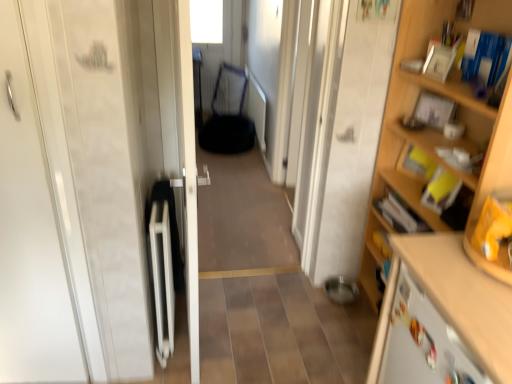
This screenshot has height=384, width=512. Describe the element at coordinates (228, 117) in the screenshot. I see `metallic mesh armchair at center` at that location.

The image size is (512, 384). In order to click on white glossy door at center, which is the first door in right-to-left order in this screenshot , I will do `click(188, 173)`.

Between wooden shelf at right and white glossy door at center, positioned as the second door in left-to-right order, which one has smaller width?

white glossy door at center, positioned as the second door in left-to-right order.

Is wooden shelf at right positioned with its back to white glossy door at center, positioned as the second door in left-to-right order?

No, white glossy door at center, positioned as the second door in left-to-right order, is not at the back of wooden shelf at right.

Would you consider wooden shelf at right to be distant from white glossy door at center, positioned as the second door in left-to-right order?

Absolutely, wooden shelf at right is distant from white glossy door at center, positioned as the second door in left-to-right order.

Can you confirm if wooden shelf at right is shorter than white glossy door at center, which is the first door in right-to-left order?

Incorrect, the height of wooden shelf at right does not fall short of that of white glossy door at center, which is the first door in right-to-left order.

From the picture: Between metallic mesh armchair at center and wooden shelf at right, which one has larger size?

With larger size is wooden shelf at right.

Is metallic mesh armchair at center positioned with its back to wooden shelf at right?

metallic mesh armchair at center does not have its back to wooden shelf at right.

Visually, is metallic mesh armchair at center positioned to the left or to the right of wooden shelf at right?

metallic mesh armchair at center is to the left of wooden shelf at right.

Considering the points (218, 139) and (510, 380), which point is in front, point (218, 139) or point (510, 380)?

Point (510, 380)

Find the location of a particular element. The height and width of the screenshot is (384, 512). armchair below the wooden cabinet at lower right (from a real-world perspective) is located at coordinates (228, 117).

Is wooden cabinet at lower right facing towards metallic mesh armchair at center?

No, wooden cabinet at lower right is not oriented towards metallic mesh armchair at center.

Which is closer to the camera, (462,336) or (240,99)?

The point (462,336) is in front.

Is wooden cabinet at lower right outside of metallic mesh armchair at center?

That's correct, wooden cabinet at lower right is outside of metallic mesh armchair at center.

Can you confirm if wooden cabinet at lower right is bigger than wooden shelf at right?

No.

Is wooden cabinet at lower right behind wooden shelf at right?

No, it is in front of wooden shelf at right.

Does wooden cabinet at lower right have a lesser height compared to wooden shelf at right?

Correct, wooden cabinet at lower right is not as tall as wooden shelf at right.

This screenshot has height=384, width=512. In order to click on cabinetry below the wooden shelf at right (from a real-world perspective) in this screenshot , I will do click(441, 316).

Is white glossy door at center, positioned as the second door in left-to-right order, oriented towards wooden cabinet at lower right?

No, white glossy door at center, positioned as the second door in left-to-right order, is not aimed at wooden cabinet at lower right.

Can you confirm if white glossy door at center, positioned as the second door in left-to-right order, is thinner than wooden cabinet at lower right?

Correct, the width of white glossy door at center, positioned as the second door in left-to-right order, is less than that of wooden cabinet at lower right.

From a real-world perspective, is white glossy door at center, positioned as the second door in left-to-right order, positioned under wooden cabinet at lower right based on gravity?

Incorrect, from a real-world perspective, white glossy door at center, positioned as the second door in left-to-right order, is higher than wooden cabinet at lower right.

Which object is positioned more to the right, white glossy door at center, positioned as the second door in left-to-right order, or wooden cabinet at lower right?

wooden cabinet at lower right is more to the right.

Which point is more distant from viewer, [437,332] or [205,123]?

Point [205,123]

Is metallic mesh armchair at center located within wooden shelf at right?

No, wooden shelf at right does not contain metallic mesh armchair at center.

Between wooden shelf at right and metallic mesh armchair at center, which one has more height?

With more height is wooden shelf at right.

Is wooden shelf at right far from metallic mesh armchair at center?

Yes.

Would you say wooden shelf at right contains wooden cabinet at lower right?

No.

This screenshot has height=384, width=512. Find the location of `cupboard behind the wooden cabinet at lower right`. cupboard behind the wooden cabinet at lower right is located at coordinates (439, 230).

From a real-world perspective, between wooden shelf at right and wooden cabinet at lower right, who is vertically lower?

wooden cabinet at lower right.

In the image, is wooden shelf at right on the left side or the right side of wooden cabinet at lower right?

Based on their positions, wooden shelf at right is located to the right of wooden cabinet at lower right.

Find the location of a particular element. cupboard on the right of white glossy door at center, positioned as the second door in left-to-right order is located at coordinates (439, 230).

Find the location of a particular element. The height and width of the screenshot is (384, 512). armchair that is on the left side of wooden shelf at right is located at coordinates (x=228, y=117).

Which object lies further to the anchor point white glossy door at left, which appears as the first door when viewed from the left, white glossy door at center, which is the first door in right-to-left order, or wooden shelf at right?

wooden shelf at right is positioned further to the anchor white glossy door at left, which appears as the first door when viewed from the left.

Estimate the real-world distances between objects in this image. Which object is closer to metallic mesh armchair at center, white glossy door at center, positioned as the second door in left-to-right order, or white glossy door at left, which appears as the first door when viewed from the left?

white glossy door at center, positioned as the second door in left-to-right order, is closer to metallic mesh armchair at center.

From the image, which object appears to be farther from wooden cabinet at lower right, white glossy door at left, placed as the second door when sorted from right to left, or wooden shelf at right?

The object further to wooden cabinet at lower right is white glossy door at left, placed as the second door when sorted from right to left.

Estimate the real-world distances between objects in this image. Which object is further from wooden cabinet at lower right, wooden shelf at right or white glossy door at center, which is the first door in right-to-left order?

white glossy door at center, which is the first door in right-to-left order, lies further to wooden cabinet at lower right than the other object.

From the image, which object appears to be nearer to white glossy door at left, placed as the second door when sorted from right to left, white glossy door at center, which is the first door in right-to-left order, or wooden cabinet at lower right?

Based on the image, white glossy door at center, which is the first door in right-to-left order, appears to be nearer to white glossy door at left, placed as the second door when sorted from right to left.

Estimate the real-world distances between objects in this image. Which object is further from wooden cabinet at lower right, metallic mesh armchair at center or wooden shelf at right?

The object further to wooden cabinet at lower right is metallic mesh armchair at center.

From the image, which object appears to be farther from white glossy door at left, placed as the second door when sorted from right to left, wooden shelf at right or white glossy door at center, which is the first door in right-to-left order?

The object further to white glossy door at left, placed as the second door when sorted from right to left, is wooden shelf at right.

Looking at the image, which one is located further to white glossy door at center, positioned as the second door in left-to-right order, wooden cabinet at lower right or metallic mesh armchair at center?

metallic mesh armchair at center is further to white glossy door at center, positioned as the second door in left-to-right order.

You are a GUI agent. You are given a task and a screenshot of the screen. Output one action in this format:
    pyautogui.click(x=<x>, y=<y>)
    Task: Click on the door located between wooden shelf at right and metallic mesh armchair at center in the depth direction
    
    Given the screenshot: What is the action you would take?
    pyautogui.click(x=188, y=173)

Identify the location of door between white glossy door at left, which appears as the first door when viewed from the left, and wooden shelf at right from left to right. (188, 173).

Find the location of `cupboard between wooden cabinet at lower right and metallic mesh armchair at center from front to back`. cupboard between wooden cabinet at lower right and metallic mesh armchair at center from front to back is located at coordinates (439, 230).

Where is `cabinetry between white glossy door at center, which is the first door in right-to-left order, and wooden shelf at right from left to right`? This screenshot has height=384, width=512. cabinetry between white glossy door at center, which is the first door in right-to-left order, and wooden shelf at right from left to right is located at coordinates (441, 316).